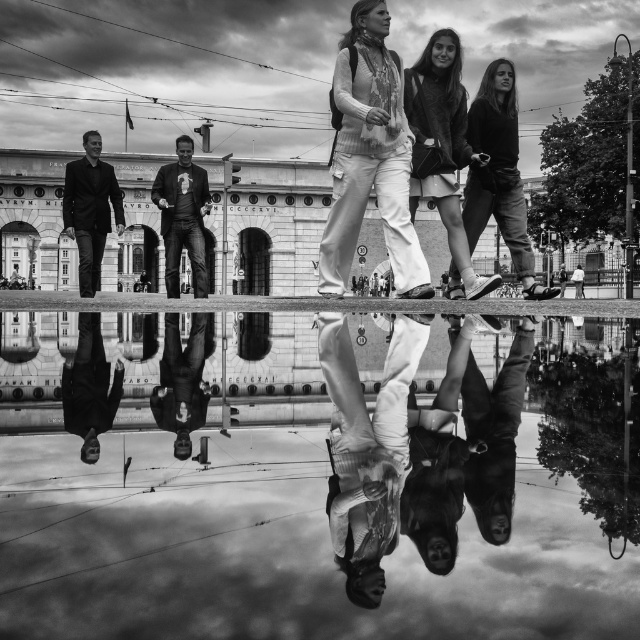
Does smooth reflective water at center come behind matte black jacket at upper right?

No, it is in front of matte black jacket at upper right.

Does smooth reflective water at center have a lesser height compared to matte black jacket at upper right?

Indeed, smooth reflective water at center has a lesser height compared to matte black jacket at upper right.

Is point (76, 561) positioned after point (467, 252)?

No, (76, 561) is in front of (467, 252).

You are a GUI agent. You are given a task and a screenshot of the screen. Output one action in this format:
    pyautogui.click(x=<x>, y=<y>)
    Task: Click on the smooth reflective water at center
    The height and width of the screenshot is (640, 640).
    Given the screenshot: What is the action you would take?
    pyautogui.click(x=275, y=548)

Does matte black jacket at upper right have a larger size compared to smooth leather shoes at center?

Correct, matte black jacket at upper right is larger in size than smooth leather shoes at center.

Is matte black jacket at upper right behind smooth leather shoes at center?

Yes, it is.

What do you see at coordinates (442, 147) in the screenshot?
I see `matte black jacket at upper right` at bounding box center [442, 147].

Locate an element on the screen. This screenshot has height=640, width=640. matte black jacket at upper right is located at coordinates (442, 147).

Does matte black jacket at upper right have a greater width compared to smooth leather jacket at center?

Indeed, matte black jacket at upper right has a greater width compared to smooth leather jacket at center.

Can you confirm if matte black jacket at upper right is positioned to the left of smooth leather jacket at center?

In fact, matte black jacket at upper right is to the right of smooth leather jacket at center.

This screenshot has height=640, width=640. What do you see at coordinates (442, 147) in the screenshot? I see `matte black jacket at upper right` at bounding box center [442, 147].

At what (x,y) coordinates should I click in order to perform the action: click on matte black jacket at upper right. Please return your answer as a coordinate pair (x, y). The image size is (640, 640). Looking at the image, I should click on (442, 147).